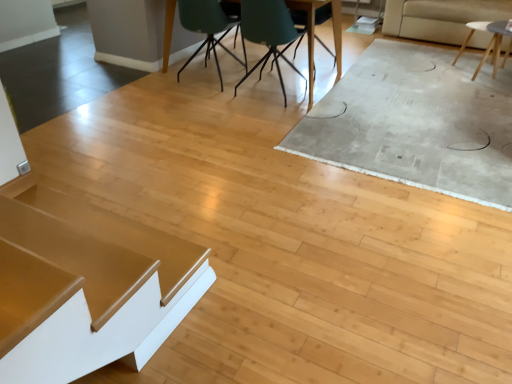
Question: Should I look upward or downward to see matte black table at center, the second table in the left-to-right sequence?

Choices:
 (A) up
 (B) down

Answer: (A)

Question: Is shiny gold table at lower left, the first table when ordered from front to back, far from white matte table at upper right, which is the 2th table in bottom-to-top order?

Choices:
 (A) yes
 (B) no

Answer: (A)

Question: Does shiny gold table at lower left, the 3th table from the right, have a lesser height compared to white matte table at upper right, marked as the 2th table in a top-to-bottom arrangement?

Choices:
 (A) yes
 (B) no

Answer: (A)

Question: Considering the relative sizes of shiny gold table at lower left, which is the first table from bottom to top, and white matte table at upper right, marked as the 2th table in a top-to-bottom arrangement, in the image provided, is shiny gold table at lower left, which is the first table from bottom to top, wider than white matte table at upper right, marked as the 2th table in a top-to-bottom arrangement,?

Choices:
 (A) yes
 (B) no

Answer: (B)

Question: Is shiny gold table at lower left, which is counted as the 3th table, starting from the top, further to the viewer compared to white matte table at upper right, which is the 2th table in bottom-to-top order?

Choices:
 (A) yes
 (B) no

Answer: (B)

Question: Can you see shiny gold table at lower left, the 3th table from the right, touching white matte table at upper right, the third table in the front-to-back sequence?

Choices:
 (A) no
 (B) yes

Answer: (A)

Question: From a real-world perspective, is shiny gold table at lower left, the 3th table from the right, under white matte table at upper right, which is the 2th table in bottom-to-top order?

Choices:
 (A) no
 (B) yes

Answer: (B)

Question: Considering the relative sizes of teal fabric chair at center, the 1th chair in the right-to-left sequence, and white matte table at upper right, which is the 2th table in bottom-to-top order, in the image provided, is teal fabric chair at center, the 1th chair in the right-to-left sequence, smaller than white matte table at upper right, which is the 2th table in bottom-to-top order,?

Choices:
 (A) no
 (B) yes

Answer: (B)

Question: Can you confirm if teal fabric chair at center, which ranks as the 3th chair in left-to-right order, is wider than white matte table at upper right, the third table in the front-to-back sequence?

Choices:
 (A) yes
 (B) no

Answer: (B)

Question: Is the depth of teal fabric chair at center, the 1th chair in the right-to-left sequence, less than that of white matte table at upper right, the third table in the front-to-back sequence?

Choices:
 (A) yes
 (B) no

Answer: (B)

Question: Does teal fabric chair at center, which ranks as the 3th chair in left-to-right order, have a lesser width compared to white matte table at upper right, marked as the 2th table in a top-to-bottom arrangement?

Choices:
 (A) yes
 (B) no

Answer: (A)

Question: Is white matte table at upper right, the third table in the front-to-back sequence, inside teal fabric chair at center, which ranks as the 3th chair in left-to-right order?

Choices:
 (A) yes
 (B) no

Answer: (B)

Question: Is teal fabric chair at center, the 1th chair in the right-to-left sequence, located outside white matte table at upper right, which is the first table from right to left?

Choices:
 (A) yes
 (B) no

Answer: (A)

Question: From the image's perspective, is shiny gold table at lower left, the first table when ordered from front to back, beneath teal matte chair at center, the 2th chair in the right-to-left sequence?

Choices:
 (A) no
 (B) yes

Answer: (B)